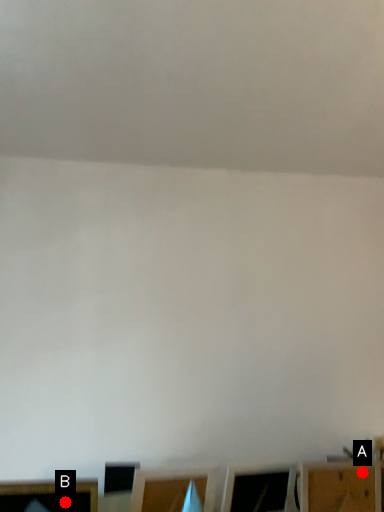
Question: Two points are circled on the image, labeled by A and B beside each circle. Which point is farther from the camera taking this photo?

Choices:
 (A) A is further
 (B) B is further

Answer: (A)